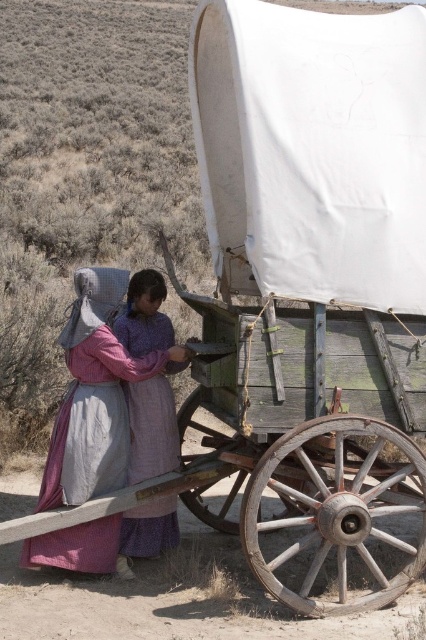
Can you confirm if white canvas wagon at upper center is thinner than matte purple dress at center?

Incorrect, white canvas wagon at upper center's width is not less than matte purple dress at center's.

Based on the photo, can you confirm if white canvas wagon at upper center is wider than matte purple dress at center?

Yes, white canvas wagon at upper center is wider than matte purple dress at center.

What do you see at coordinates (313, 150) in the screenshot? I see `white canvas wagon at upper center` at bounding box center [313, 150].

This screenshot has height=640, width=426. Find the location of `white canvas wagon at upper center`. white canvas wagon at upper center is located at coordinates (313, 150).

Who is positioned more to the left, wooden wagon at center or matte purple dress at center?

Positioned to the left is matte purple dress at center.

In the scene shown: Between wooden wagon at center and matte purple dress at center, which one has less height?

Standing shorter between the two is matte purple dress at center.

Who is more forward, (x=314, y=436) or (x=147, y=472)?

Point (x=314, y=436) is more forward.

Image resolution: width=426 pixels, height=640 pixels. Identify the location of wooden wagon at center. (302, 449).

Is white canvas wagon at upper center above rustic woolen dress at lower left?

Indeed, white canvas wagon at upper center is positioned over rustic woolen dress at lower left.

Who is taller, white canvas wagon at upper center or rustic woolen dress at lower left?

With more height is white canvas wagon at upper center.

Which is behind, point (317, 253) or point (143, 364)?

Point (143, 364)

Locate an element on the screen. This screenshot has height=640, width=426. white canvas wagon at upper center is located at coordinates [x=313, y=150].